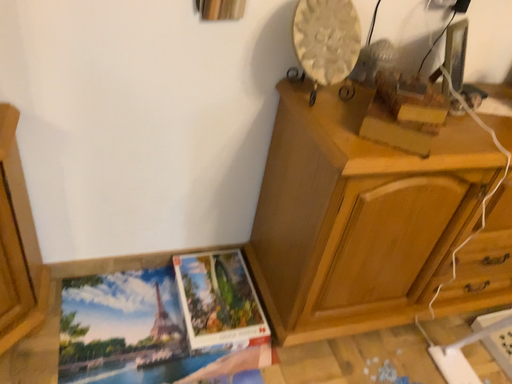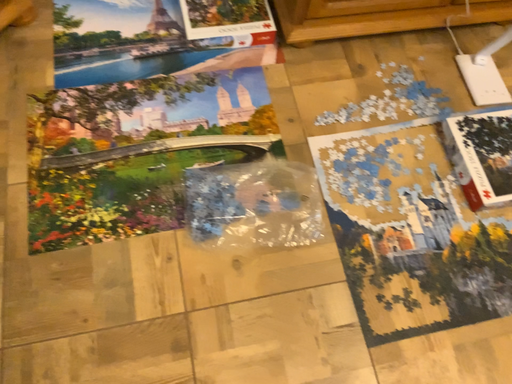
Question: How did the camera likely rotate when shooting the video?

Choices:
 (A) rotated upward
 (B) rotated downward

Answer: (B)